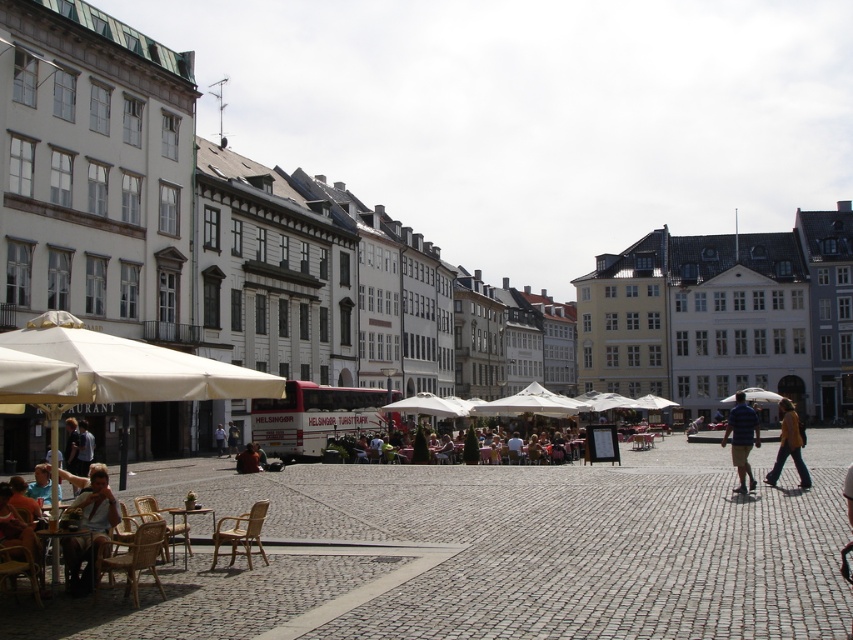
You are a tourist standing in the urban square and want to take a photo of the yellow fabric jacket at center. To avoid including the white fabric canopy at left in your photo, should you move to the right or left?

The white fabric canopy at left is positioned on the left side of the yellow fabric jacket at center. To avoid including the white fabric canopy at left in your photo, you should move to the right side of the yellow fabric jacket at center so that the canopy is out of frame.